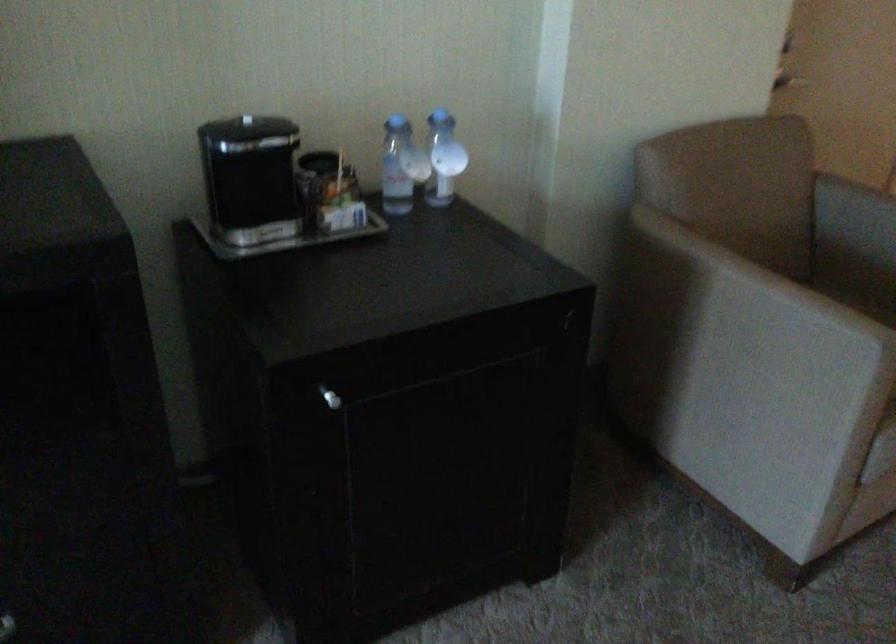
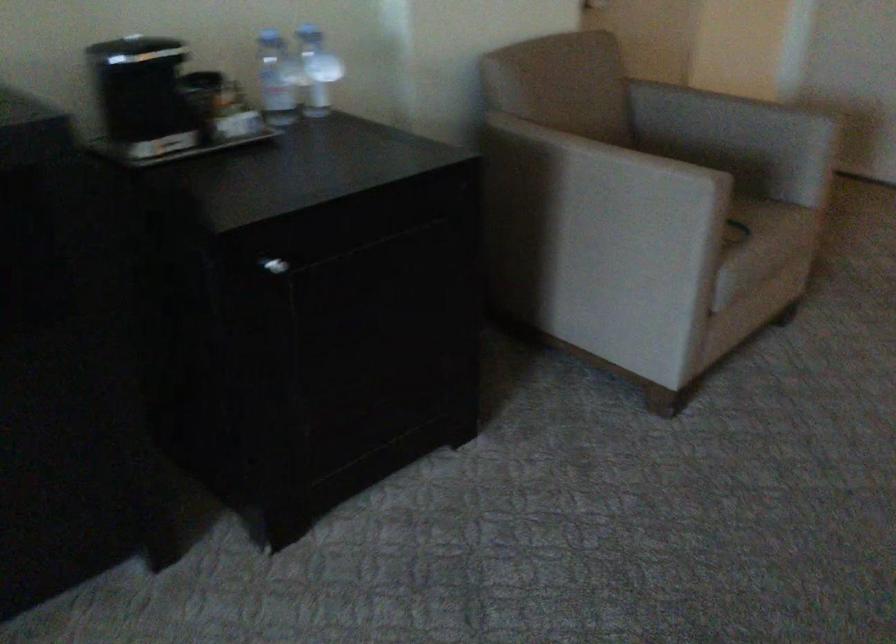
Question: The camera is either moving clockwise (left) or counter-clockwise (right) around the object. The first image is from the beginning of the video and the second image is from the end. Is the camera moving left or right when shooting the video?

Choices:
 (A) Left
 (B) Right

Answer: (A)